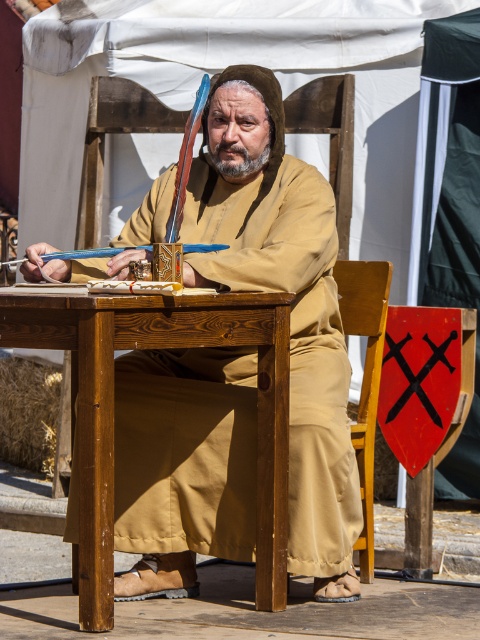
Between brown clothed man at center and wooden table at center, which one appears on the right side from the viewer's perspective?

From the viewer's perspective, brown clothed man at center appears more on the right side.

In the scene shown: How much distance is there between brown clothed man at center and wooden table at center?

A distance of 18.64 inches exists between brown clothed man at center and wooden table at center.

Where is `brown clothed man at center`? Image resolution: width=480 pixels, height=640 pixels. brown clothed man at center is located at coordinates (283, 291).

Does brown clothed man at center appear under wooden chair at center?

No, brown clothed man at center is not below wooden chair at center.

Between point (342, 426) and point (359, 428), which one is positioned behind?

The point (359, 428) is more distant.

Where is `brown clothed man at center`? Image resolution: width=480 pixels, height=640 pixels. brown clothed man at center is located at coordinates (283, 291).

Locate an element on the screen. The width and height of the screenshot is (480, 640). wooden table at center is located at coordinates (112, 410).

Which is in front, point (78, 547) or point (365, 394)?

Point (78, 547) is more forward.

Between point (60, 312) and point (360, 392), which one is positioned in front?

Point (60, 312) is in front.

Identify the location of wooden table at center. This screenshot has width=480, height=640. (112, 410).